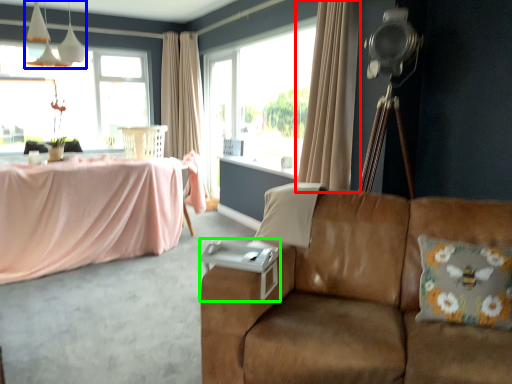
Question: Which object is the farthest from curtain (highlighted by a red box)? Choose among these: fixture (highlighted by a blue box) or side table (highlighted by a green box).

Choices:
 (A) fixture
 (B) side table

Answer: (A)